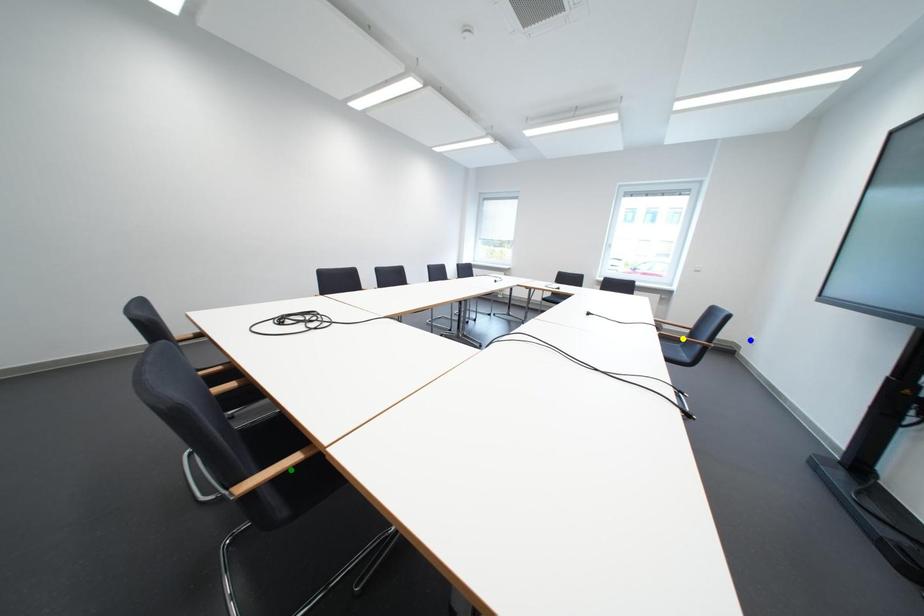
Order these from nearest to farthest:
yellow point, green point, blue point

green point < yellow point < blue point